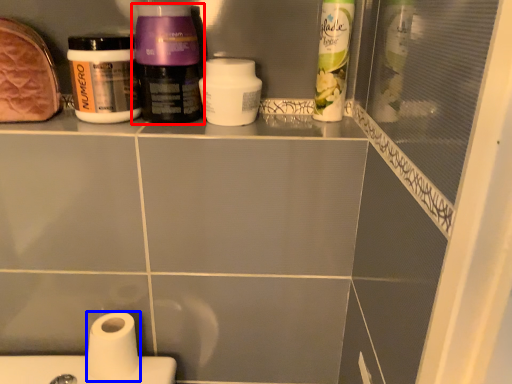
Question: Which of the following is the farthest to the observer, bottle (highlighted by a red box) or toilet paper (highlighted by a blue box)?

Choices:
 (A) bottle
 (B) toilet paper

Answer: (B)